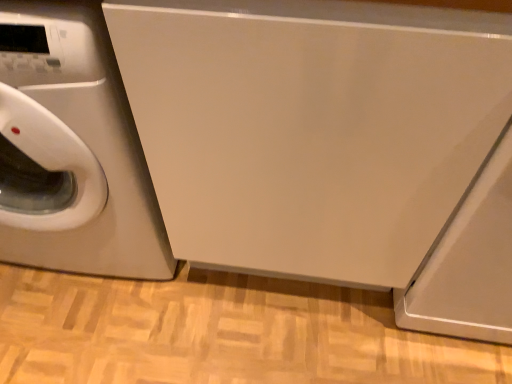
This screenshot has height=384, width=512. I want to click on matte white washing machine at left, so click(72, 150).

In order to face matte white washing machine at left, should I rotate leftwards or rightwards?

Rotate your view left by about 24.563°.

The image size is (512, 384). Describe the element at coordinates (72, 150) in the screenshot. I see `matte white washing machine at left` at that location.

You are a GUI agent. You are given a task and a screenshot of the screen. Output one action in this format:
    pyautogui.click(x=<x>, y=<y>)
    Task: Click on the matte white washing machine at left
    This screenshot has width=512, height=384.
    Given the screenshot: What is the action you would take?
    pyautogui.click(x=72, y=150)